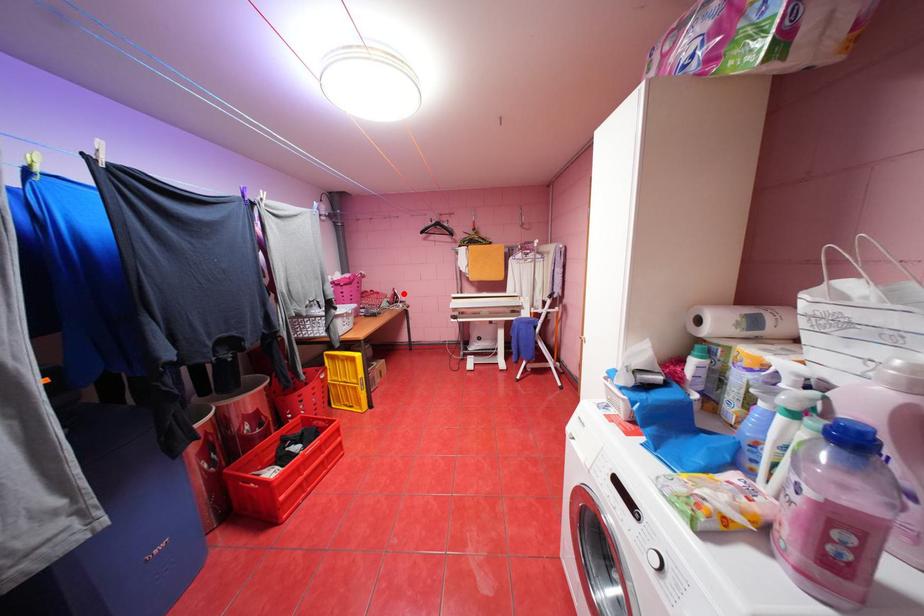
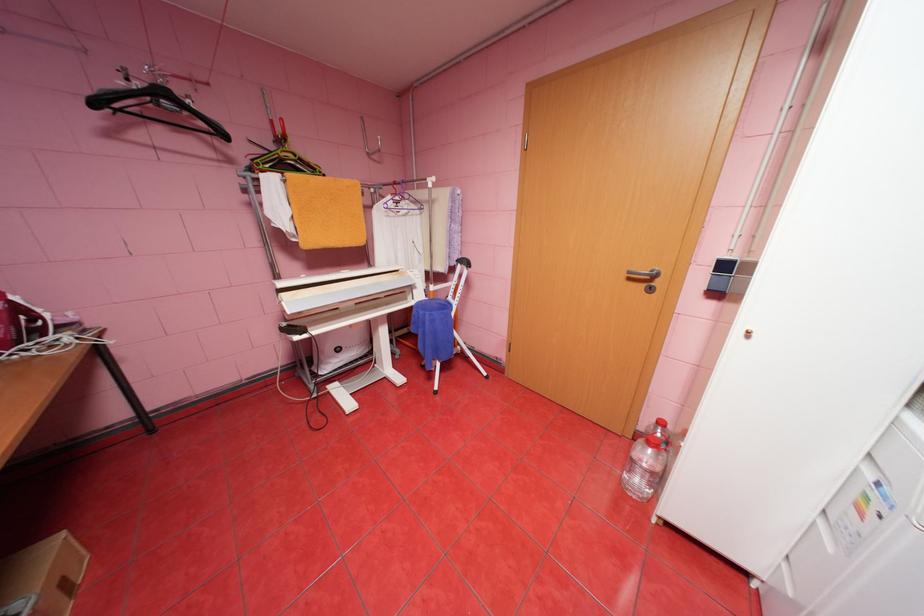
Where in the second image is the point corresponding to the highlighted location from the first image?

(26, 309)